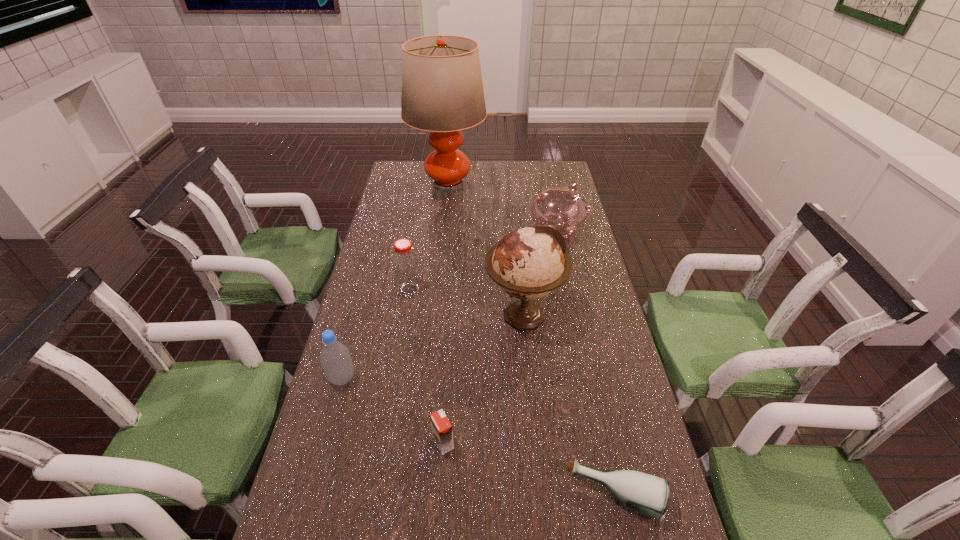
At what (x,y) coordinates should I click in order to perform the action: click on the tallest object. Please return your answer as a coordinate pair (x, y). The width and height of the screenshot is (960, 540). Looking at the image, I should click on (442, 90).

Where is `the farthest object`? The height and width of the screenshot is (540, 960). the farthest object is located at coordinates (442, 90).

Locate an element on the screen. This screenshot has height=540, width=960. globe is located at coordinates (528, 263).

I want to click on the farthest bottle, so click(x=405, y=264).

At what (x,y) coordinates should I click in order to perform the action: click on the sixth nearest object. Please return your answer as a coordinate pair (x, y). The width and height of the screenshot is (960, 540). Looking at the image, I should click on (563, 208).

Locate an element on the screen. This screenshot has height=540, width=960. the leftmost bottle is located at coordinates (335, 358).

At what (x,y) coordinates should I click in order to perform the action: click on the fifth farthest object. Please return your answer as a coordinate pair (x, y). Looking at the image, I should click on (335, 358).

At what (x,y) coordinates should I click in order to perform the action: click on orange juice. Please return your answer as a coordinate pair (x, y). Image resolution: width=960 pixels, height=540 pixels. Looking at the image, I should click on (442, 434).

Where is `the second nearest object`? Image resolution: width=960 pixels, height=540 pixels. the second nearest object is located at coordinates (442, 434).

Identify the location of the rightmost bottle. (648, 494).